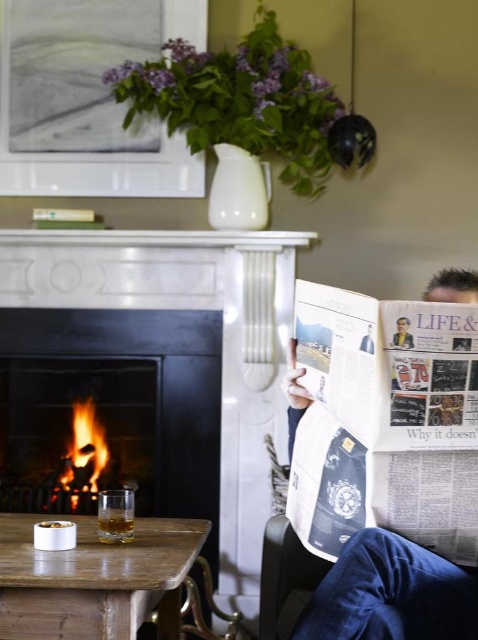
Who is higher up, white paper newspaper at right or matte paper newspaper at center?

Positioned higher is matte paper newspaper at center.

Is point (447, 605) closer to camera compared to point (403, 316)?

No, it is behind (403, 316).

Is point (306, 609) closer to camera compared to point (394, 344)?

That is False.

Identify the location of white paper newspaper at right. Image resolution: width=478 pixels, height=640 pixels. (391, 595).

Is black metal fireplace at left smaller than matte paper newspaper at center?

Incorrect, black metal fireplace at left is not smaller in size than matte paper newspaper at center.

Between point (109, 339) and point (401, 326), which one is positioned behind?

The point (109, 339) is more distant.

Where is `black metal fireplace at left`? black metal fireplace at left is located at coordinates (115, 404).

In order to click on wooden table at lower left in this screenshot , I will do [94, 579].

Who is lower down, wooden table at lower left or white paper newspaper at right?

wooden table at lower left

The height and width of the screenshot is (640, 478). What do you see at coordinates (94, 579) in the screenshot?
I see `wooden table at lower left` at bounding box center [94, 579].

The width and height of the screenshot is (478, 640). Find the location of `wooden table at lower left`. wooden table at lower left is located at coordinates (94, 579).